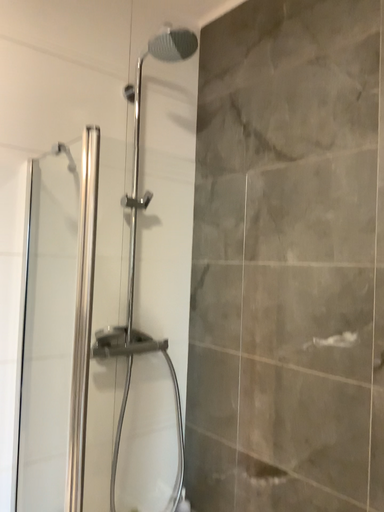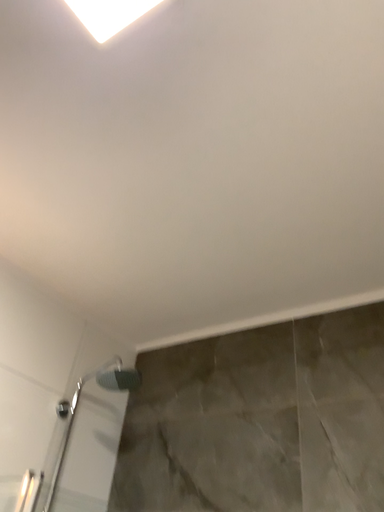
Question: How did the camera likely rotate when shooting the video?

Choices:
 (A) rotated downward
 (B) rotated upward

Answer: (B)